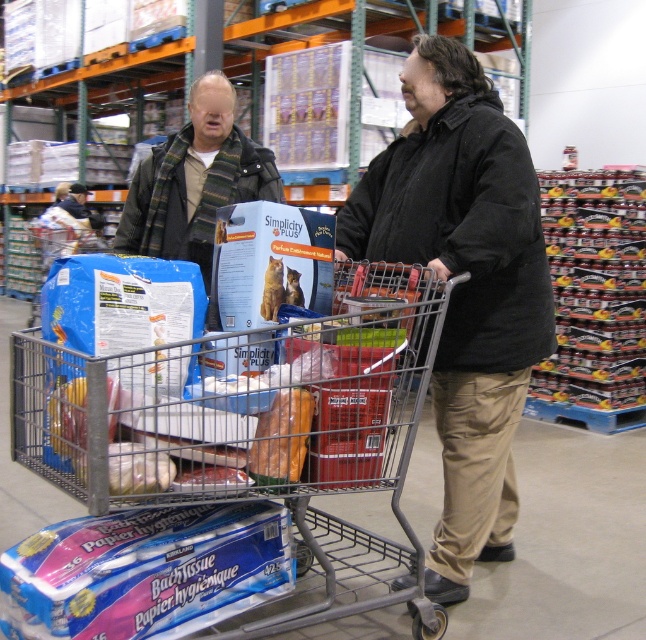
Question: Is black matte jacket at center wider than brown leather wallet at center?

Choices:
 (A) yes
 (B) no

Answer: (A)

Question: Which of the following is the closest to the observer?

Choices:
 (A) (253, 444)
 (B) (234, 637)

Answer: (B)

Question: Which object is the farthest from the metallic gray trolley at center?

Choices:
 (A) brown leather wallet at center
 (B) black matte jacket at center

Answer: (B)

Question: Is the position of metallic gray trolley at center less distant than that of brown leather wallet at center?

Choices:
 (A) no
 (B) yes

Answer: (B)

Question: Can you confirm if black matte jacket at center is wider than brown leather wallet at center?

Choices:
 (A) no
 (B) yes

Answer: (B)

Question: Which of the following is the farthest from the observer?

Choices:
 (A) (98, 616)
 (B) (297, 442)

Answer: (B)